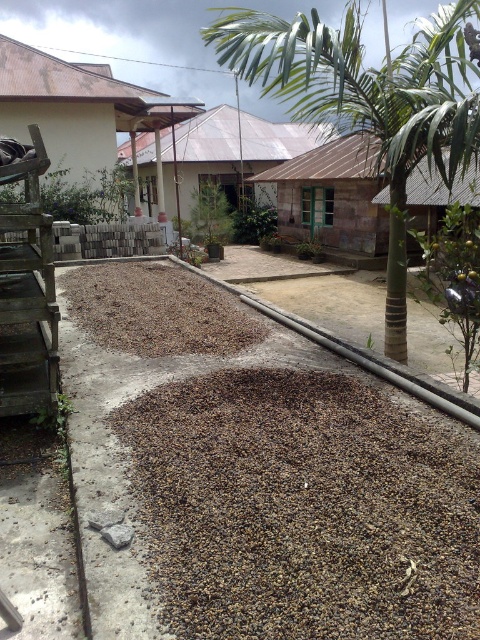
Can you confirm if dark brown gravel at center is shorter than brown gravel at center?

No, dark brown gravel at center is not shorter than brown gravel at center.

This screenshot has height=640, width=480. What do you see at coordinates (303, 509) in the screenshot?
I see `dark brown gravel at center` at bounding box center [303, 509].

Find the location of a particular element. This screenshot has width=480, height=640. dark brown gravel at center is located at coordinates (303, 509).

Is point (210, 618) less distant than point (311, 35)?

Yes, it is in front of point (311, 35).

Locate an element on the screen. The height and width of the screenshot is (640, 480). dark brown gravel at center is located at coordinates (303, 509).

Is green leafy palm tree at upper center above brown gravel at center?

Indeed, green leafy palm tree at upper center is positioned over brown gravel at center.

Can you confirm if green leafy palm tree at upper center is positioned to the right of brown gravel at center?

Correct, you'll find green leafy palm tree at upper center to the right of brown gravel at center.

Is point (208, 29) farther from camera compared to point (107, 332)?

Yes.

At what (x,y) coordinates should I click in order to perform the action: click on green leafy palm tree at upper center. Please return your answer as a coordinate pair (x, y). This screenshot has height=640, width=480. Looking at the image, I should click on (370, 100).